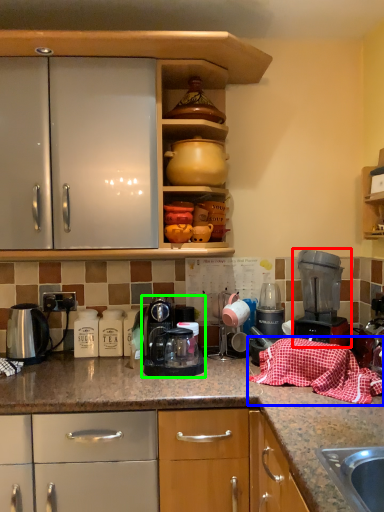
Question: Estimate the real-world distances between objects in this image. Which object is closer to home appliance (highlighted by a red box), blanket (highlighted by a blue box) or kitchen appliance (highlighted by a green box)?

Choices:
 (A) blanket
 (B) kitchen appliance

Answer: (A)